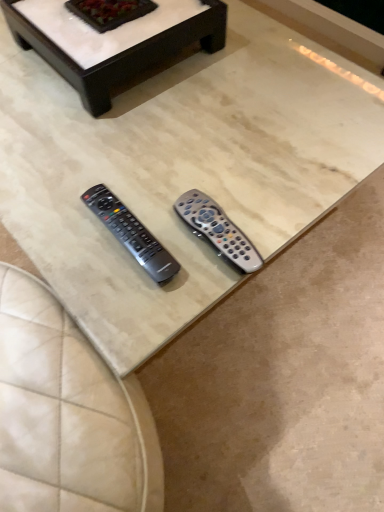
Where is `vacant point above beige marble coffee table at center, the first coffee table in the front-to-back sequence (from a real-world perspective)`? vacant point above beige marble coffee table at center, the first coffee table in the front-to-back sequence (from a real-world perspective) is located at coordinates (157, 108).